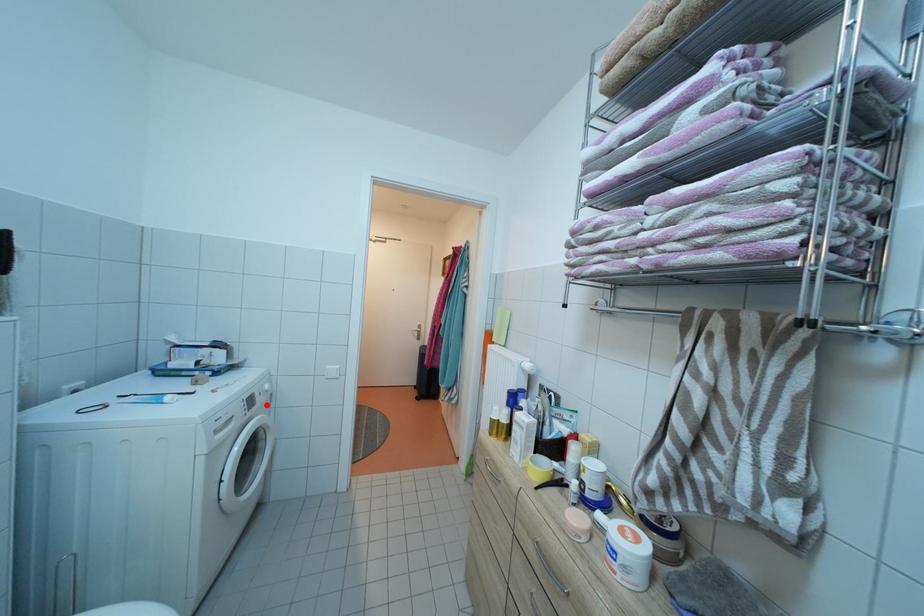
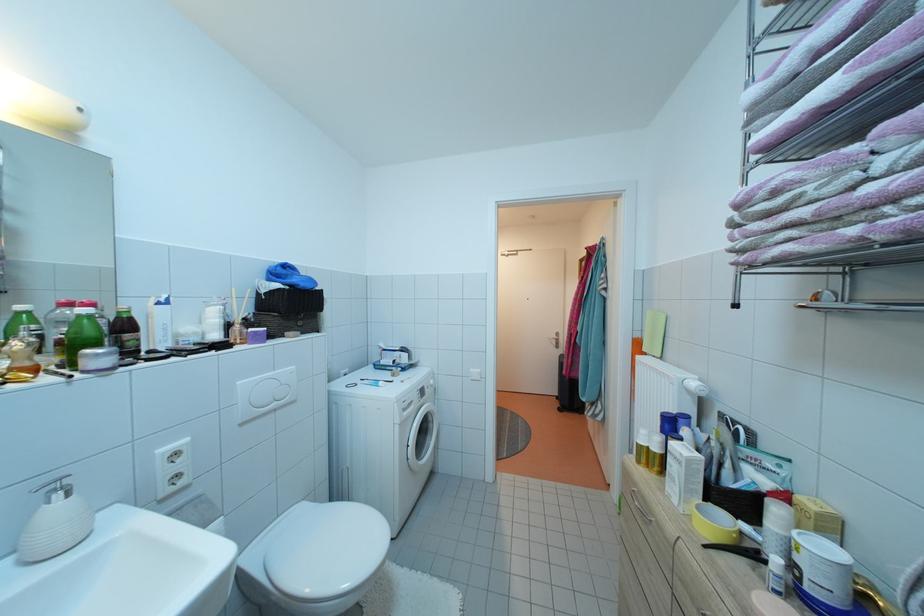
Locate, in the second image, the point that corresponds to the highlighted location in the first image.

(434, 397)